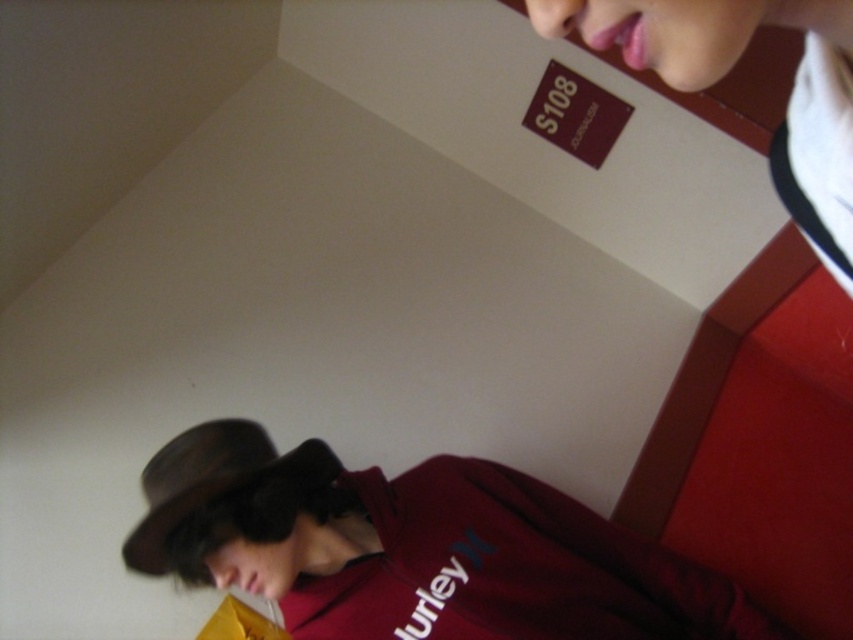
Question: Can you confirm if matte maroon hoodie at lower right is smaller than brown felt fedora at lower left?

Choices:
 (A) no
 (B) yes

Answer: (A)

Question: Among these objects, which one is farthest from the camera?

Choices:
 (A) matte maroon hoodie at lower right
 (B) brown felt fedora at lower left

Answer: (A)

Question: Is matte maroon hoodie at lower right behind brown felt fedora at lower left?

Choices:
 (A) no
 (B) yes

Answer: (B)

Question: Which point appears closest to the camera in this image?

Choices:
 (A) (398, 529)
 (B) (219, 483)

Answer: (B)

Question: Is matte maroon hoodie at lower right wider than brown felt fedora at lower left?

Choices:
 (A) no
 (B) yes

Answer: (B)